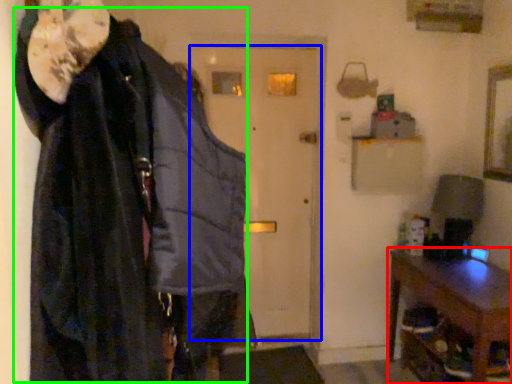
Question: Which object is the closest to the furniture (highlighted by a red box)? Choose among these: door (highlighted by a blue box) or cloak (highlighted by a green box).

Choices:
 (A) door
 (B) cloak

Answer: (A)